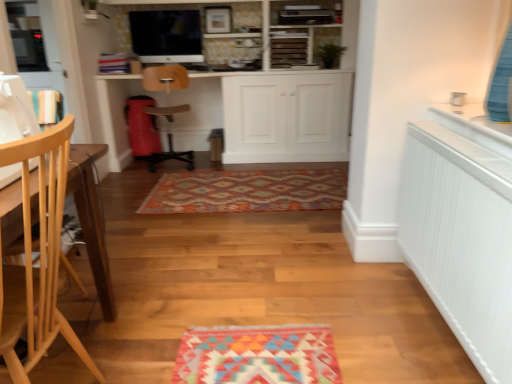
Question: From a real-world perspective, is satin black monitor at upper center above or below light wood chair at left, which appears as the second chair when viewed from the top?

Choices:
 (A) above
 (B) below

Answer: (A)

Question: From the image's perspective, is satin black monitor at upper center positioned above or below light wood chair at left, arranged as the second chair when viewed from the back?

Choices:
 (A) above
 (B) below

Answer: (A)

Question: Based on their relative distances, which object is farther from the white matte cabinet at center?

Choices:
 (A) satin black monitor at upper center
 (B) white textured radiator at right
 (C) wooden at center, the second chair in the bottom-to-top sequence
 (D) wooden sewing machine at left
 (E) light wood chair at left, which appears as the second chair when viewed from the top

Answer: (E)

Question: Considering the real-world distances, which object is closest to the wooden sewing machine at left?

Choices:
 (A) wooden at center, the second chair in the bottom-to-top sequence
 (B) light wood chair at left, arranged as the 1th chair when ordered from the bottom
 (C) satin black monitor at upper center
 (D) white matte cabinet at center
 (E) white textured radiator at right

Answer: (B)